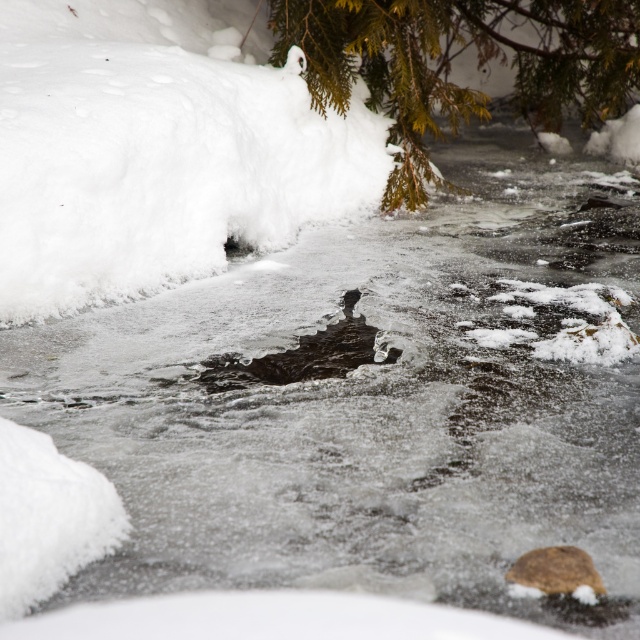
Is white fluffy snow at center smaller than green textured branch at upper center?

Incorrect, white fluffy snow at center is not smaller in size than green textured branch at upper center.

Is point (29, 269) positioned before point (589, 112)?

Yes, point (29, 269) is in front of point (589, 112).

Does point (22, 166) come farther from viewer compared to point (538, 56)?

No, (22, 166) is closer to viewer.

Identify the location of white fluffy snow at center. (156, 152).